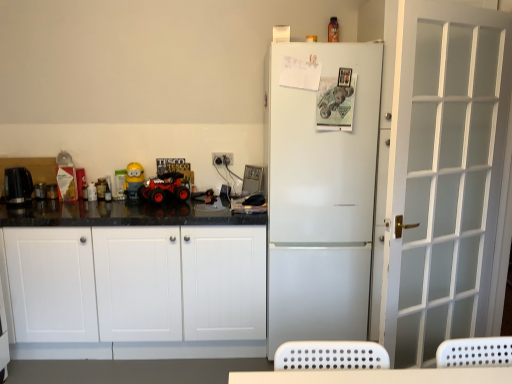
Question: From a real-world perspective, relative to white matte refrigerator at center, is black plastic kettle at left, positioned as the first appliance in back-to-front order, vertically above or below?

Choices:
 (A) above
 (B) below

Answer: (A)

Question: Does point (39, 185) appear closer or farther from the camera than point (279, 200)?

Choices:
 (A) farther
 (B) closer

Answer: (A)

Question: Estimate the real-world distances between objects in this image. Which object is closer to the rubberized red toy car at center?

Choices:
 (A) white matte refrigerator at center
 (B) yellow matte toy at center
 (C) black plastic kettle at left, the 1th appliance positioned from the front
 (D) black plastic kettle at left, which ranks as the 2th appliance in front-to-back order
 (E) white matte cabinet at left

Answer: (B)

Question: Which object is the farthest from the yellow matte toy at center?

Choices:
 (A) black plastic kettle at left, which ranks as the 2th appliance in front-to-back order
 (B) black plastic kettle at left, which appears as the second appliance when viewed from the back
 (C) white matte refrigerator at center
 (D) white matte cabinet at left
 (E) rubberized red toy car at center

Answer: (C)